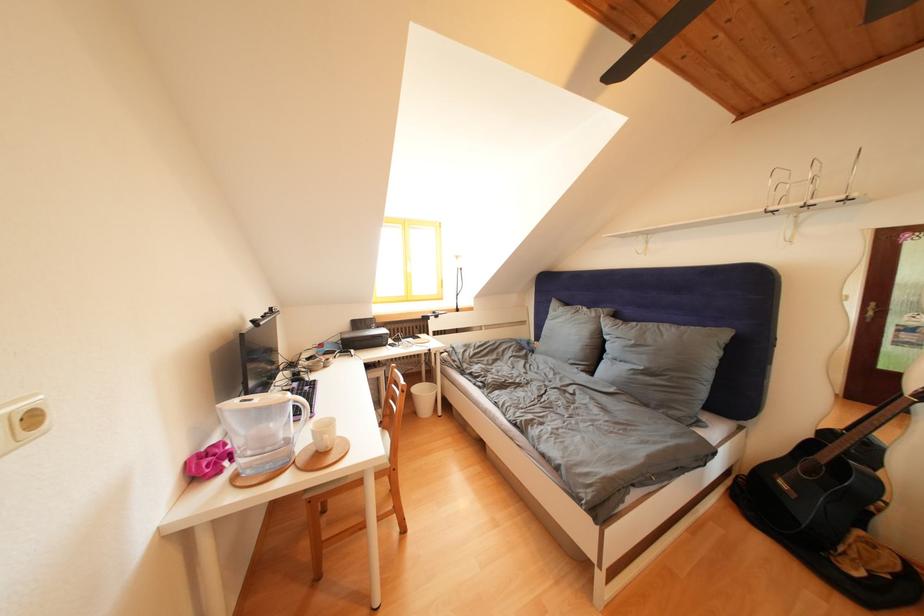
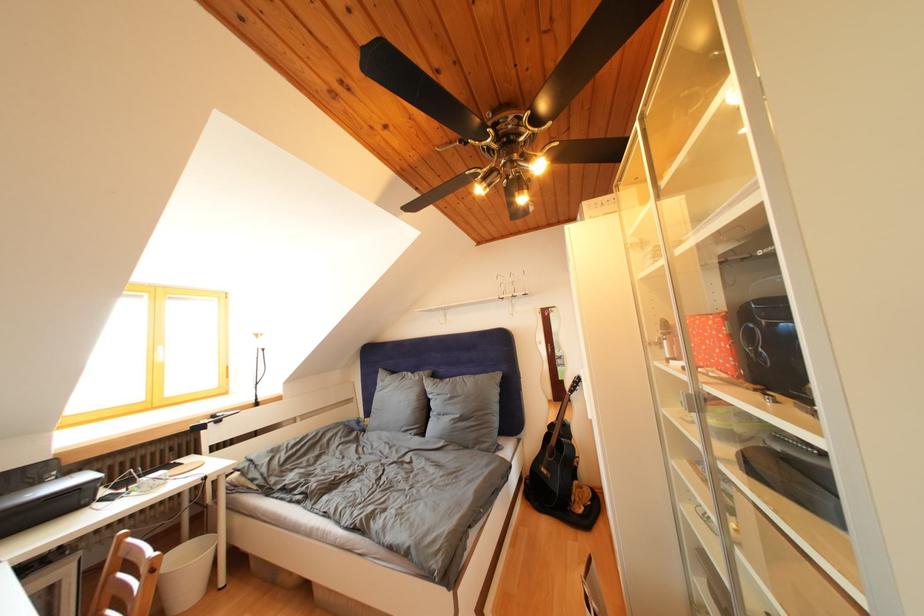
Find the pixel in the second image that matches point (398, 389) in the first image.

(119, 578)